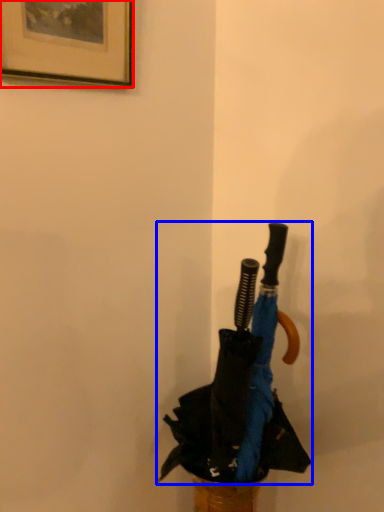
Question: Among these objects, which one is farthest to the camera, picture frame (highlighted by a red box) or umbrella (highlighted by a blue box)?

Choices:
 (A) picture frame
 (B) umbrella

Answer: (B)